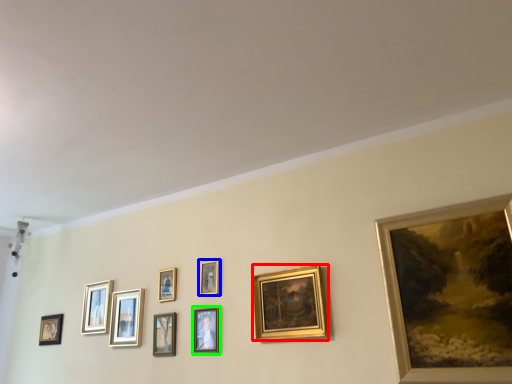
Question: Considering the real-world distances, which object is farthest from picture frame (highlighted by a red box)? picture frame (highlighted by a blue box) or picture frame (highlighted by a green box)?

Choices:
 (A) picture frame
 (B) picture frame

Answer: (A)